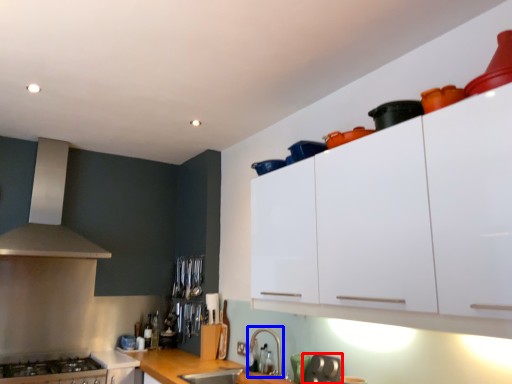
Question: Which of the following is the farthest to the observer, appliance (highlighted by a red box) or faucet (highlighted by a blue box)?

Choices:
 (A) appliance
 (B) faucet

Answer: (B)